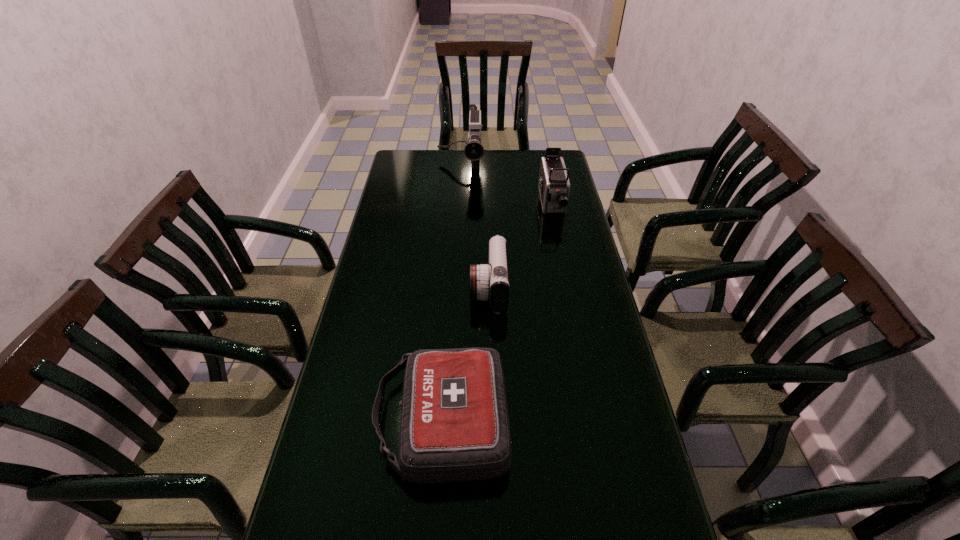
The image size is (960, 540). What are the coordinates of `free spot located on the surface of the second shortest object` in the screenshot? It's located at (403, 289).

Find the location of a particular element. free space located on the surface of the second shortest object is located at coordinates (446, 289).

Locate an element on the screen. free location located on the back of the first-aid kit is located at coordinates point(450,300).

I want to click on object located in the far edge section of the desktop, so click(474, 151).

You are a GUI agent. You are given a task and a screenshot of the screen. Output one action in this format:
    pyautogui.click(x=<x>, y=<y>)
    Task: Click on the object that is at the left edge
    
    Given the screenshot: What is the action you would take?
    pyautogui.click(x=454, y=426)

Find the location of a particular element. Image resolution: width=960 pixels, height=540 pixels. object situated at the right edge is located at coordinates (554, 186).

You are a GUI agent. You are given a task and a screenshot of the screen. Output one action in this format:
    pyautogui.click(x=<x>, y=<y>)
    Task: Click on the free space at the far edge
    
    Given the screenshot: What is the action you would take?
    pyautogui.click(x=502, y=159)

Identify the location of free space at the left edge of the desktop. (391, 259).

In the image, there is a desktop. Where is `vacant space at the right edge`? Image resolution: width=960 pixels, height=540 pixels. vacant space at the right edge is located at coordinates (540, 218).

Identify the location of vacant position at the far left corner of the desktop. This screenshot has height=540, width=960. (426, 170).